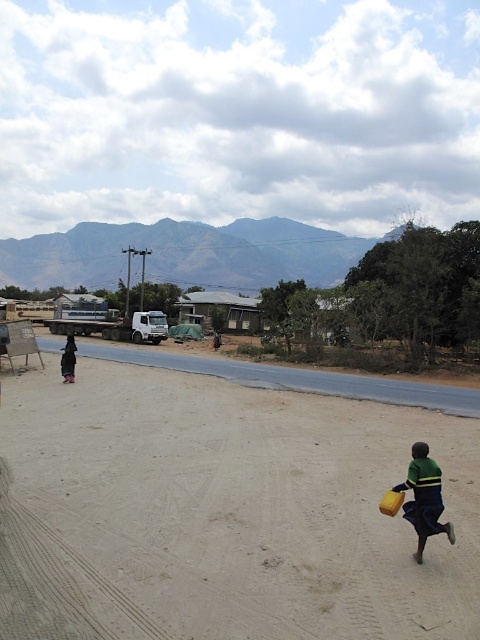
In the scene shown: You are standing at the edge of the road and want to walk towards the green jersey at lower right. Which direction should you move relative to the brown sandy dirt track at lower center?

Since the brown sandy dirt track at lower center is closer to the viewer than the green jersey at lower right, you should move towards the right side of the track to reach the green jersey at lower right.

You are standing at the starting point of the dirt road and want to reach the brown sandy dirt track at lower center. In which direction should you walk relative to the road?

The brown sandy dirt track at lower center is located at point coordinates, so you should walk towards the lower center direction along the road to reach it.